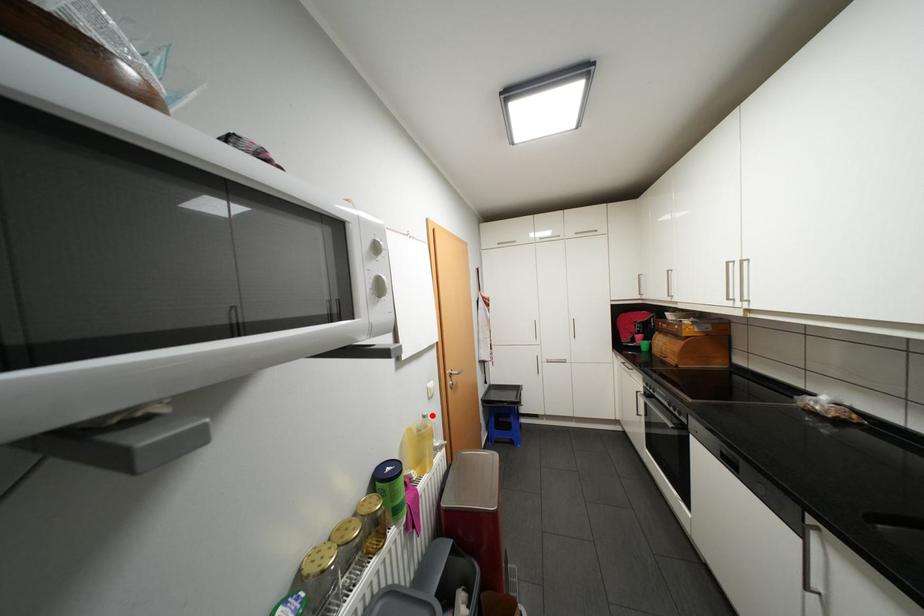
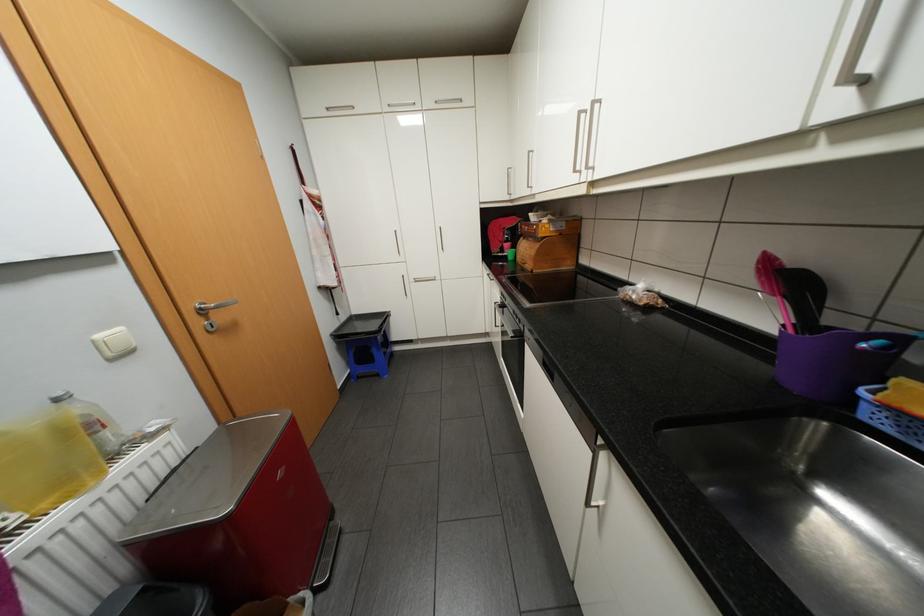
Locate, in the second image, the point that corresponds to the highlighted location in the first image.

(65, 399)